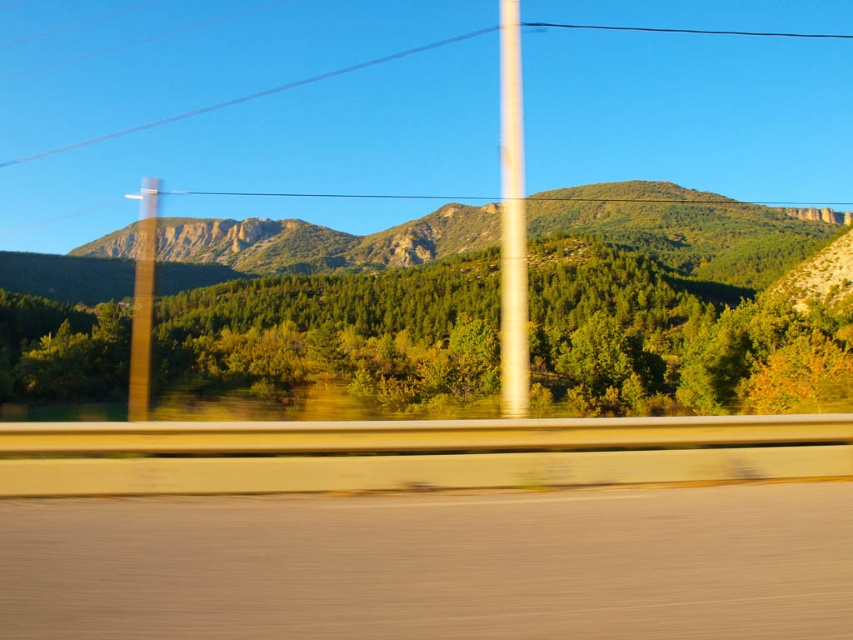
Consider the image. Can you confirm if green leafy tree at center is thinner than green textured mountain at center?

Indeed, green leafy tree at center has a lesser width compared to green textured mountain at center.

Is green leafy tree at center in front of green textured mountain at center?

Yes, green leafy tree at center is closer to the viewer.

Is point (376, 376) positioned before point (656, 218)?

Yes, point (376, 376) is in front of point (656, 218).

Where is `green leafy tree at center`? Image resolution: width=853 pixels, height=640 pixels. green leafy tree at center is located at coordinates (335, 339).

Who is taller, smooth asphalt highway at lower center or green leafy tree at center?

green leafy tree at center

Describe the element at coordinates (434, 564) in the screenshot. I see `smooth asphalt highway at lower center` at that location.

Where is `smooth asphalt highway at lower center`? The width and height of the screenshot is (853, 640). smooth asphalt highway at lower center is located at coordinates (434, 564).

Is the position of smooth asphalt highway at lower center more distant than that of green textured mountain at center?

No, smooth asphalt highway at lower center is in front of green textured mountain at center.

Is point (341, 550) less distant than point (80, 253)?

Yes.

Where is `smooth asphalt highway at lower center`? smooth asphalt highway at lower center is located at coordinates (434, 564).